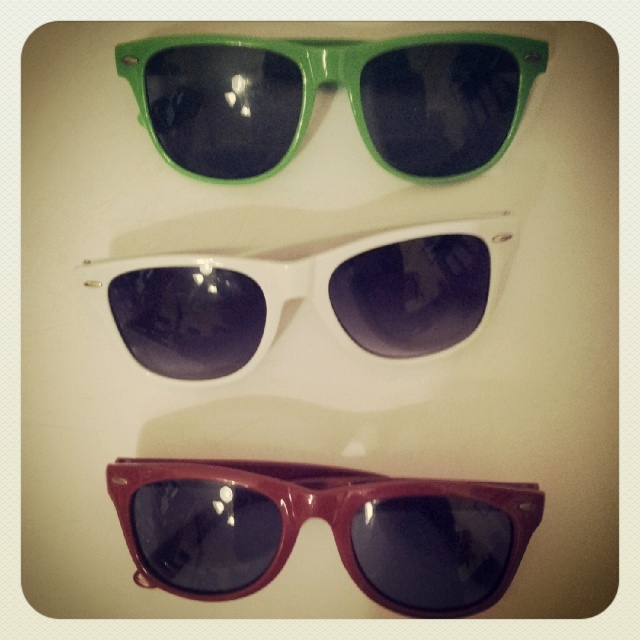
Question: Is green glossy sunglasses at upper center to the left of white glossy sunglasses at center from the viewer's perspective?

Choices:
 (A) no
 (B) yes

Answer: (A)

Question: Which point is closer to the camera taking this photo?

Choices:
 (A) (243, 372)
 (B) (400, 604)
 (C) (225, 61)

Answer: (C)

Question: Considering the real-world distances, which object is farthest from the green glossy sunglasses at upper center?

Choices:
 (A) white glossy sunglasses at center
 (B) glossy burgundy sunglasses at bottom

Answer: (B)

Question: Can you confirm if glossy burgundy sunglasses at bottom is positioned below green glossy sunglasses at upper center?

Choices:
 (A) no
 (B) yes

Answer: (B)

Question: Which of the following is the farthest from the observer?

Choices:
 (A) (472, 502)
 (B) (172, 352)

Answer: (B)

Question: In this image, where is green glossy sunglasses at upper center located relative to white glossy sunglasses at center?

Choices:
 (A) right
 (B) left

Answer: (A)